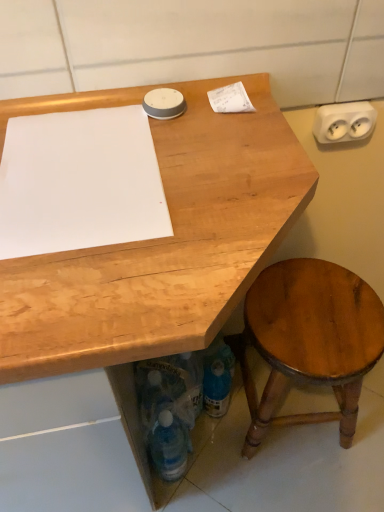
You are a GUI agent. You are given a task and a screenshot of the screen. Output one action in this format:
    pyautogui.click(x=<x>, y=<y>)
    Task: Click on the free space that is in between white paper at upper right, positioned as the 2th notepad in left-to-right order, and white paper at upper left, acting as the second notepad starting from the top
    This screenshot has height=512, width=384.
    Given the screenshot: What is the action you would take?
    pyautogui.click(x=195, y=148)